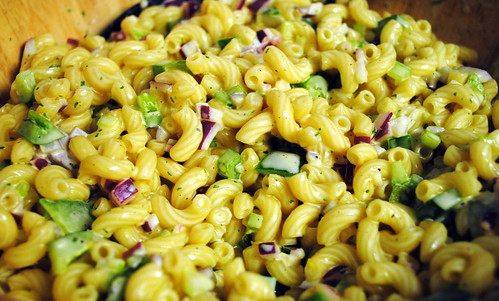
Locate an element on the screen. Image resolution: width=499 pixels, height=301 pixels. right side of bowl is located at coordinates (463, 26).